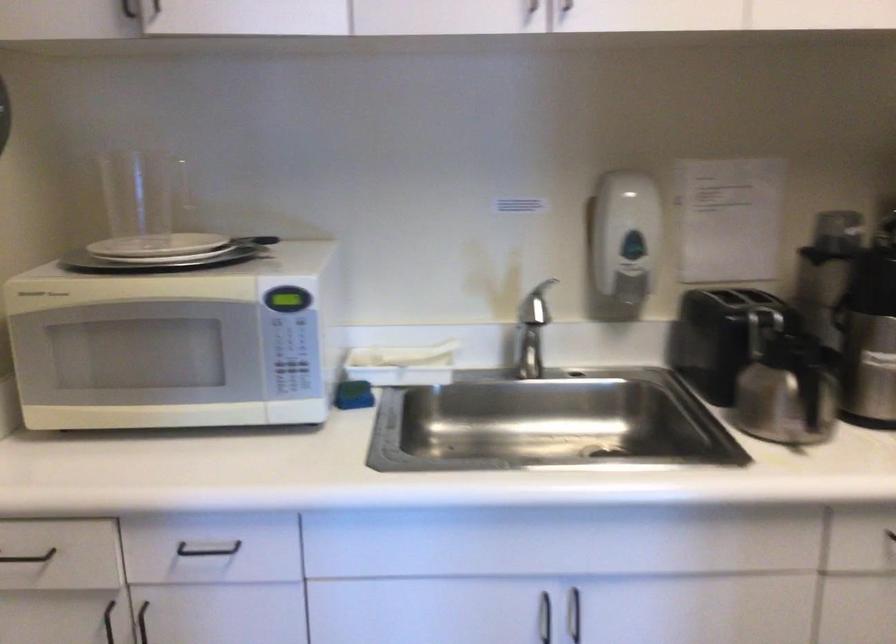
Find the location of a particular element. The height and width of the screenshot is (644, 896). microwave buttons is located at coordinates (291, 365).